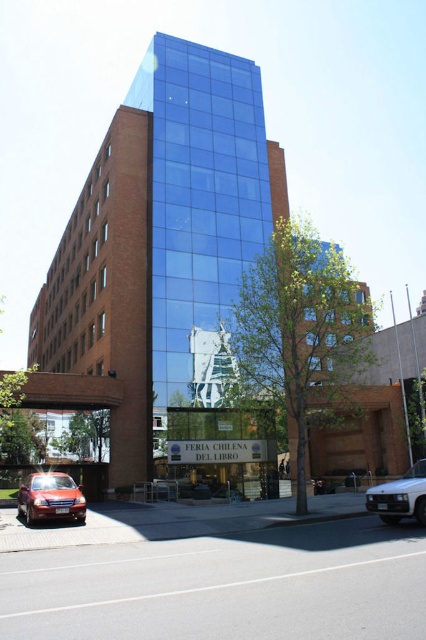
Question: Is shiny red sedan at lower left to the right of white matte car at lower right from the viewer's perspective?

Choices:
 (A) yes
 (B) no

Answer: (B)

Question: Does shiny red sedan at lower left appear on the left side of white matte car at lower right?

Choices:
 (A) yes
 (B) no

Answer: (A)

Question: Which point appears closest to the camera in this image?

Choices:
 (A) [x=31, y=508]
 (B) [x=425, y=470]

Answer: (B)

Question: Where is shiny red sedan at lower left located in relation to white matte car at lower right in the image?

Choices:
 (A) above
 (B) below

Answer: (B)

Question: Which of the following is the closest to the observer?

Choices:
 (A) shiny red sedan at lower left
 (B) white matte car at lower right

Answer: (B)